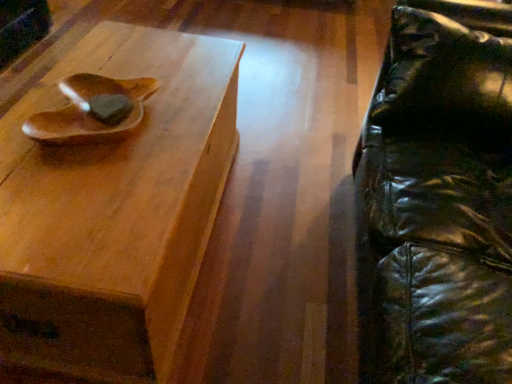
The width and height of the screenshot is (512, 384). What are the coordinates of `free space behind wooden bowl at upper left` in the screenshot? It's located at (139, 67).